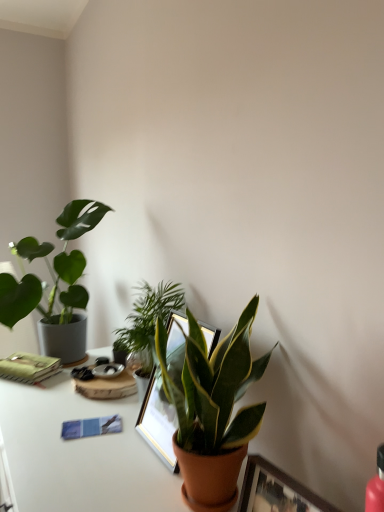
At what (x,y) coordinates should I click in order to perform the action: click on free spot above white glossy table at lower center (from a real-world perspective). Please return your answer as a coordinate pair (x, y). The width and height of the screenshot is (384, 512). Looking at the image, I should click on (78, 437).